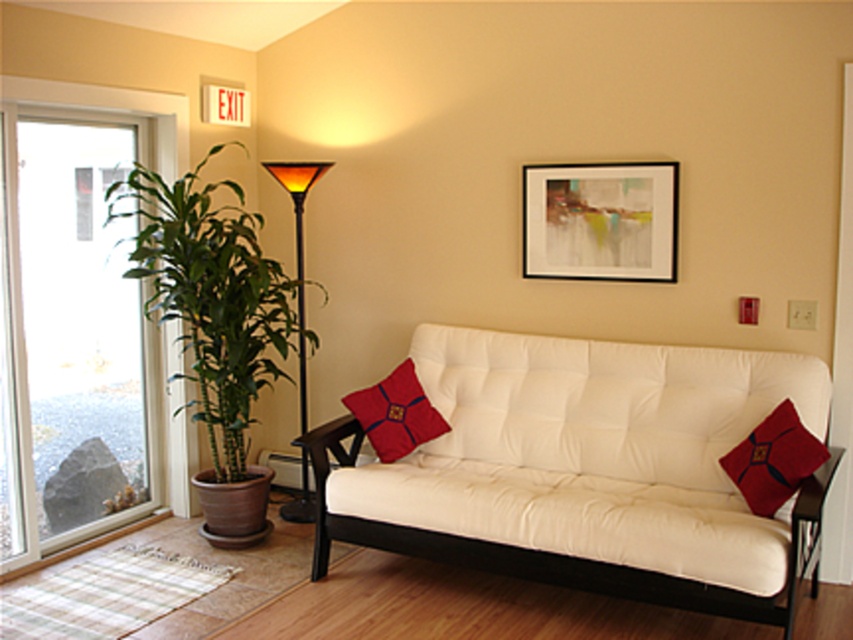
The height and width of the screenshot is (640, 853). Describe the element at coordinates (85, 316) in the screenshot. I see `clear glass door at left` at that location.

Is clear glass door at left bigger than green leafy plant at left?

Indeed, clear glass door at left has a larger size compared to green leafy plant at left.

Locate an element on the screen. The width and height of the screenshot is (853, 640). clear glass door at left is located at coordinates (85, 316).

I want to click on clear glass door at left, so click(x=85, y=316).

Which of these two, velvet red pillow at center or amber glass lamp at center, stands shorter?

With less height is velvet red pillow at center.

Does point (393, 451) lie behind point (309, 506)?

No, (393, 451) is closer to viewer.

Measure the distance between velvet red pillow at center and camera.

velvet red pillow at center and camera are 3.96 meters apart from each other.

Image resolution: width=853 pixels, height=640 pixels. In order to click on velvet red pillow at center in this screenshot , I will do `click(395, 413)`.

Who is positioned more to the left, white leather couch at center or black matte picture frame at upper center?

white leather couch at center

Looking at this image, who is taller, white leather couch at center or black matte picture frame at upper center?

white leather couch at center is taller.

Between point (498, 497) and point (566, 212), which one is positioned behind?

The point (566, 212) is behind.

This screenshot has width=853, height=640. In order to click on white leather couch at center in this screenshot , I will do pos(587,470).